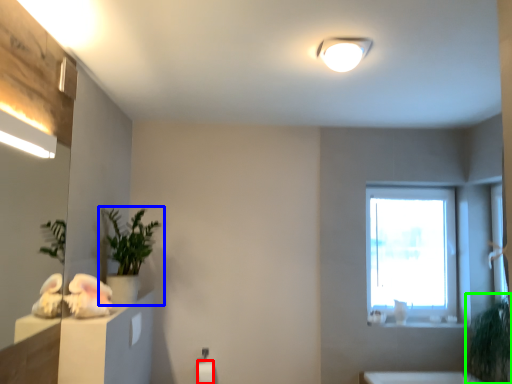
Question: Considering the real-world distances, which object is closest to toilet paper (highlighted by a red box)? houseplant (highlighted by a blue box) or plant (highlighted by a green box).

Choices:
 (A) houseplant
 (B) plant

Answer: (A)